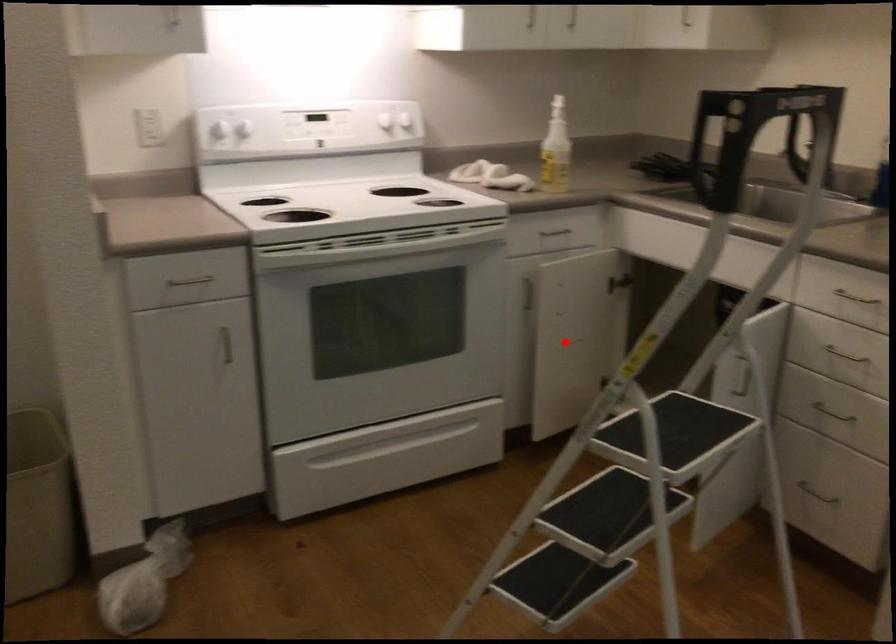
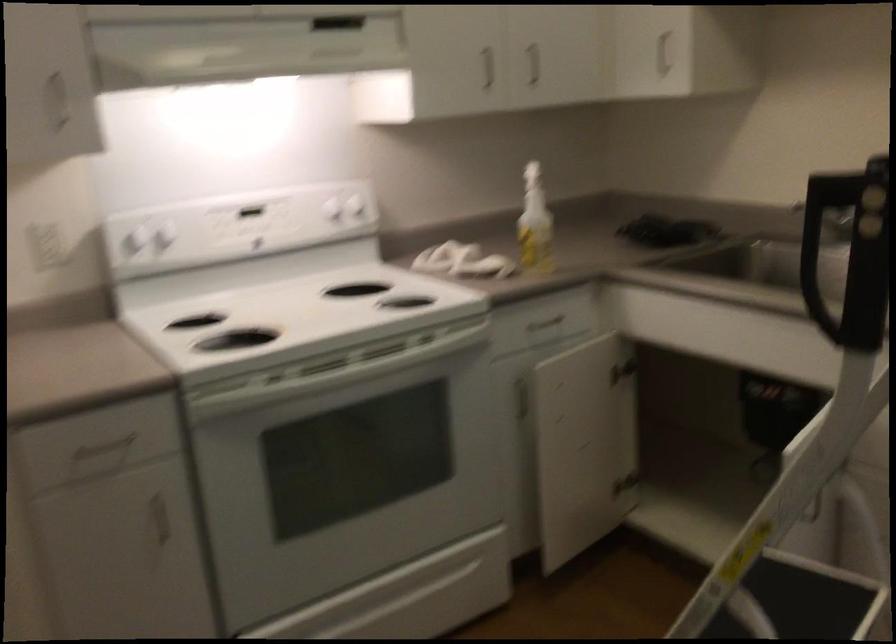
Question: I am providing you with two images of the same scene from different viewpoints. Image1 has a red point marked. In image2, the corresponding 3D location appears at what relative position? Reply with the corresponding letter.

Choices:
 (A) Closer
 (B) Farther

Answer: (A)